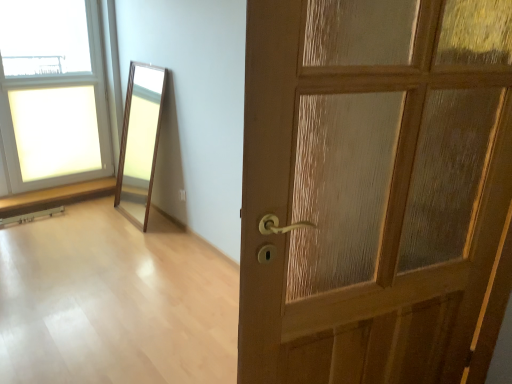
Question: Visually, is wooden door at right positioned to the left or to the right of wooden floor at center?

Choices:
 (A) right
 (B) left

Answer: (A)

Question: Is wooden door at right taller or shorter than wooden floor at center?

Choices:
 (A) tall
 (B) short

Answer: (A)

Question: Which object is positioned farthest from the wooden door at right?

Choices:
 (A) wooden floor at center
 (B) clear glass window at upper left

Answer: (B)

Question: Considering the real-world distances, which object is closest to the wooden door at right?

Choices:
 (A) wooden floor at center
 (B) clear glass window at upper left

Answer: (A)